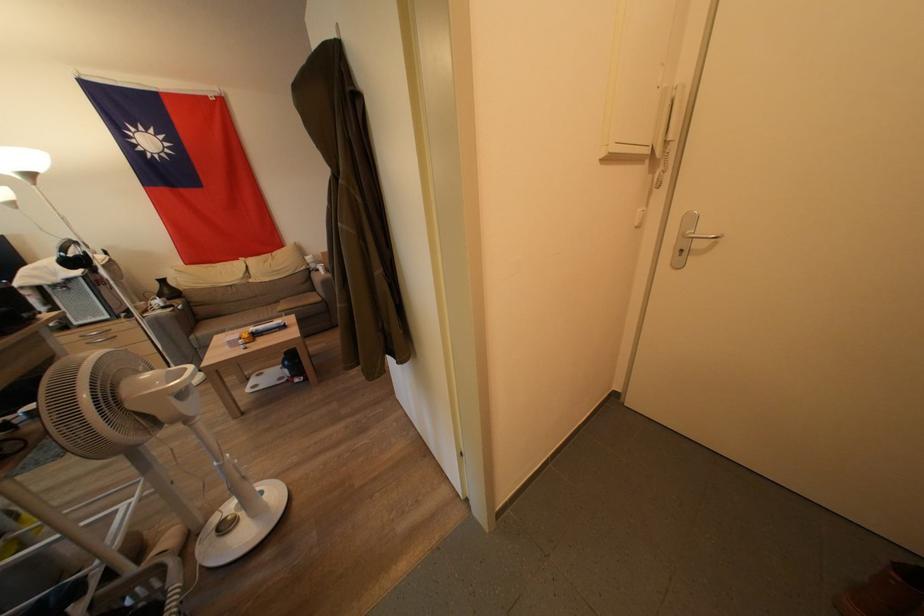
The image size is (924, 616). Describe the element at coordinates (106, 338) in the screenshot. I see `the drawer handle` at that location.